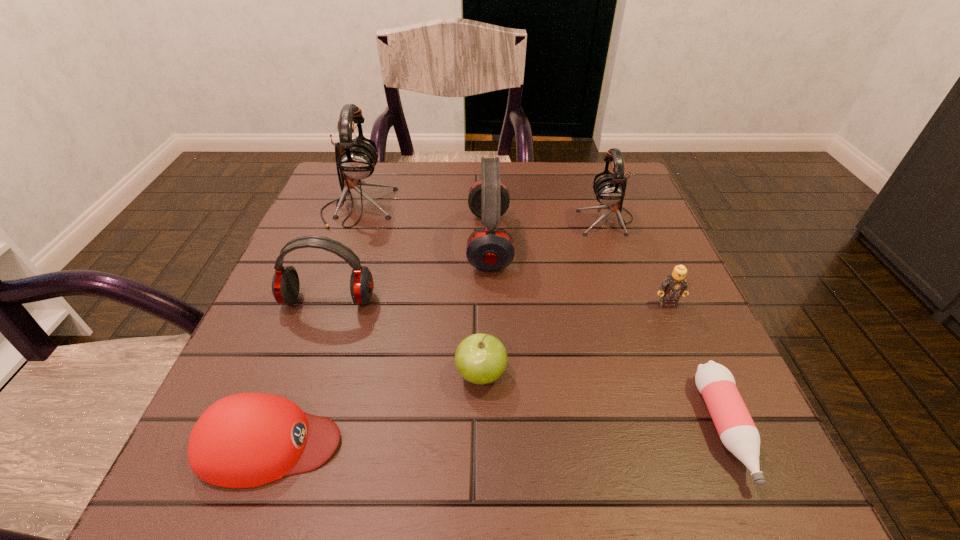
Find the location of `the tallest earphone`. the tallest earphone is located at coordinates (356, 159).

The height and width of the screenshot is (540, 960). What are the coordinates of `the left black earphone` in the screenshot? It's located at (356, 159).

Where is `the farther red earphone`? The height and width of the screenshot is (540, 960). the farther red earphone is located at coordinates (490, 248).

In order to click on the bigger red earphone in this screenshot , I will do `click(490, 248)`.

You are a GUI agent. You are given a task and a screenshot of the screen. Output one action in this format:
    pyautogui.click(x=<x>, y=<y>)
    Task: Click on the rightmost earphone
    This screenshot has height=540, width=960.
    Given the screenshot: What is the action you would take?
    pyautogui.click(x=609, y=189)

Locate an element on the screen. the smaller black earphone is located at coordinates (609, 189).

What are the coordinates of `the smaller red earphone` in the screenshot? It's located at (285, 284).

This screenshot has height=540, width=960. I want to click on the left red earphone, so click(x=285, y=284).

Identify the location of green apple. The width and height of the screenshot is (960, 540). (480, 358).

This screenshot has width=960, height=540. Find the location of `tan Lego`. tan Lego is located at coordinates (675, 285).